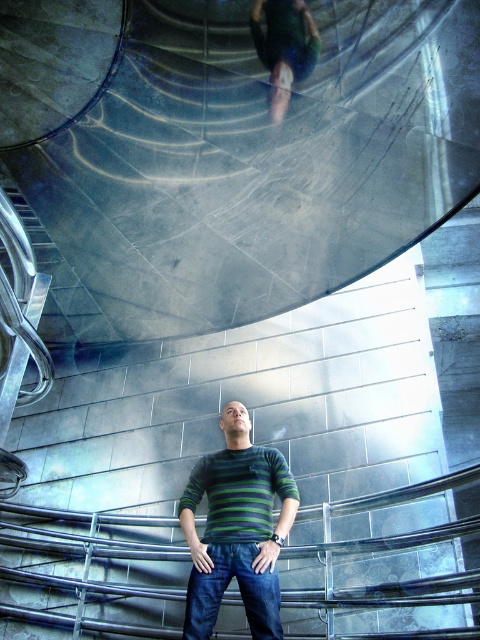
Question: Does green striped sweater at center come behind dark blue denim jeans at center?

Choices:
 (A) no
 (B) yes

Answer: (B)

Question: Which object is the closest to the green fabric skateboard at upper center?

Choices:
 (A) green striped sweater at center
 (B) green striped shirt at center

Answer: (B)

Question: Which object is farther from the camera taking this photo?

Choices:
 (A) green fabric skateboard at upper center
 (B) dark blue denim jeans at center
 (C) green striped sweater at center
 (D) green striped shirt at center

Answer: (A)

Question: From the image, what is the correct spatial relationship of green striped shirt at center in relation to green striped sweater at center?

Choices:
 (A) below
 (B) above

Answer: (A)

Question: In this image, where is green striped shirt at center located relative to green fabric skateboard at upper center?

Choices:
 (A) right
 (B) left

Answer: (B)

Question: Which point is closer to the camera?

Choices:
 (A) (256, 595)
 (B) (192, 545)
 (C) (240, 461)
 (D) (297, 54)

Answer: (A)